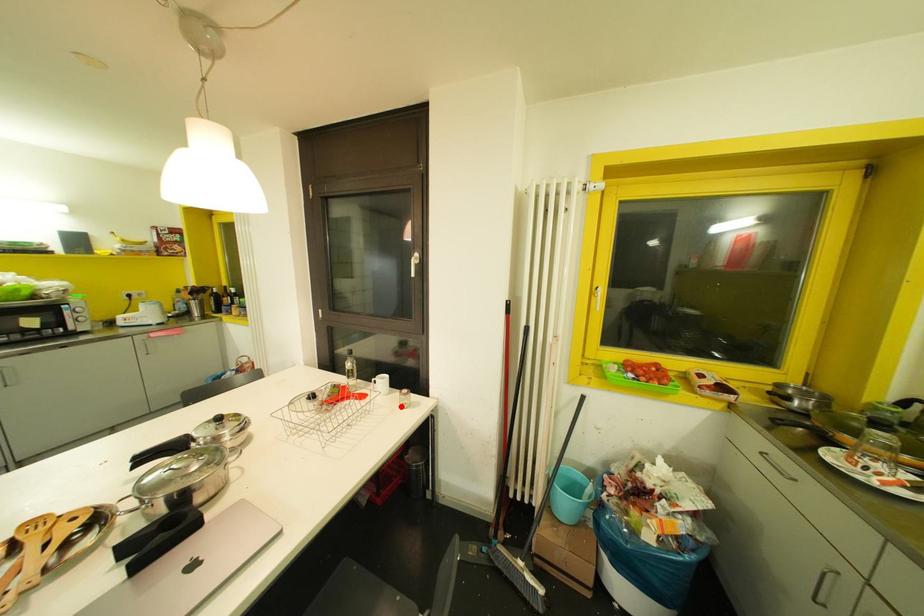
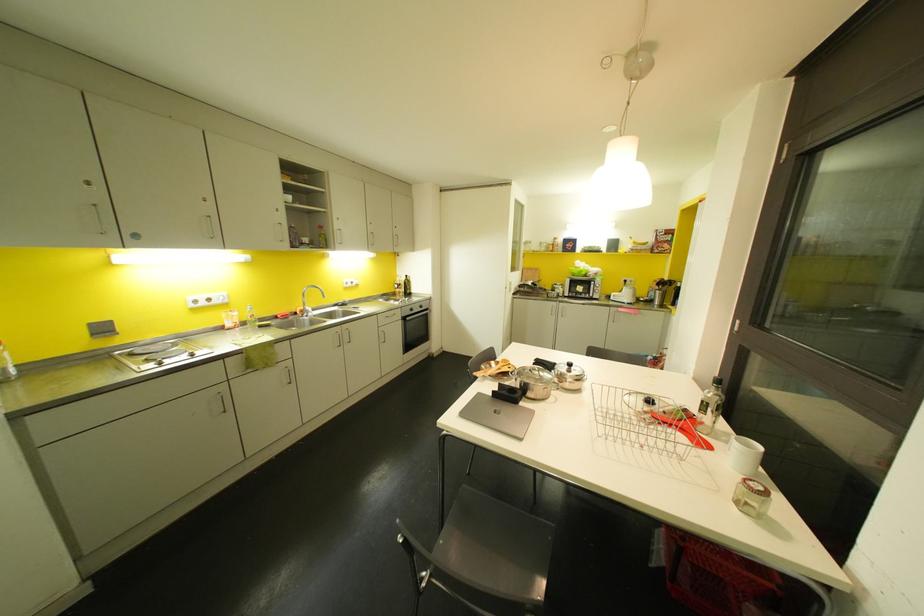
The point at the highlighted location is marked in the first image. Where is the corresponding point in the second image?

(736, 501)